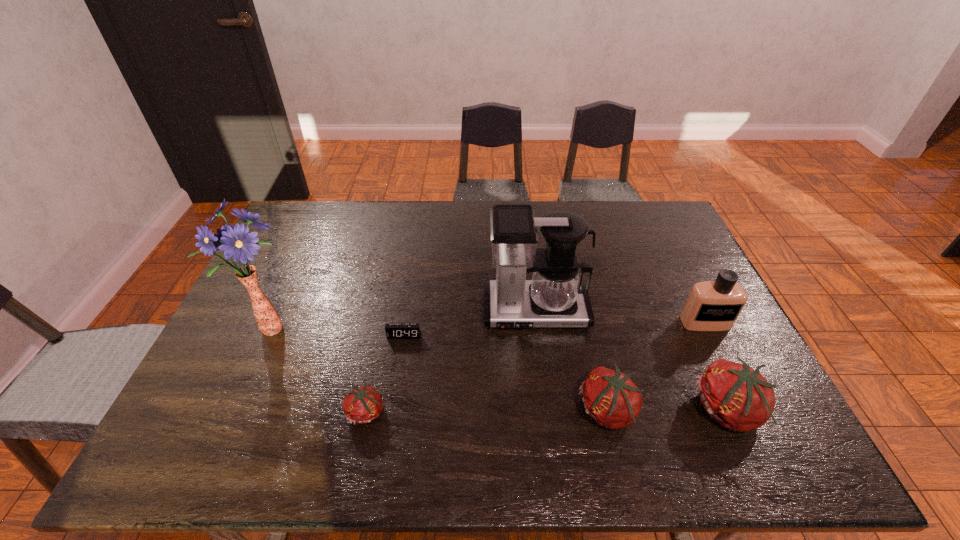
Please point a location where one more tomato can be added evenly. Please provide its 2D coordinates. Your answer should be formatted as a tuple, i.e. [(x, y)], where the tuple contains the x and y coordinates of a point satisfying the conditions above.

[(488, 411)]